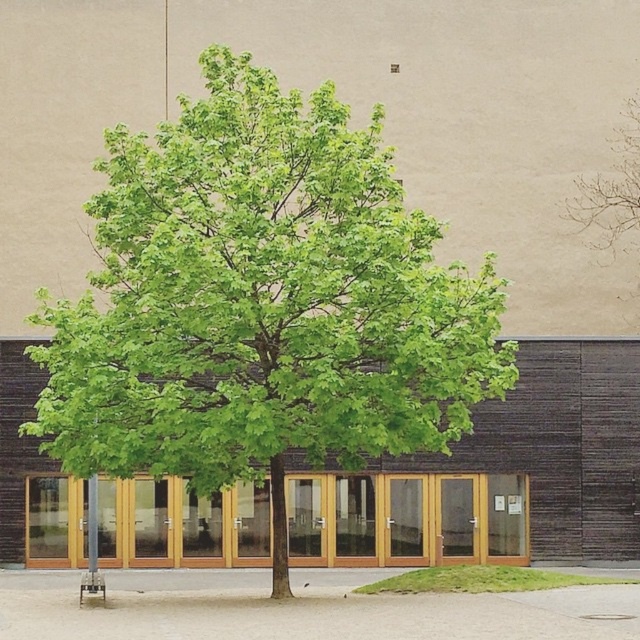
Question: Where is green leafy tree at center located in relation to green leafy tree at upper center in the image?

Choices:
 (A) left
 (B) right

Answer: (A)

Question: Among these objects, which one is nearest to the camera?

Choices:
 (A) green leafy tree at center
 (B) green leafy tree at upper center

Answer: (A)

Question: Which point is closer to the camera?

Choices:
 (A) green leafy tree at upper center
 (B) green leafy tree at center

Answer: (B)

Question: Does green leafy tree at center appear under green leafy tree at upper center?

Choices:
 (A) no
 (B) yes

Answer: (B)

Question: Can you confirm if green leafy tree at center is positioned below green leafy tree at upper center?

Choices:
 (A) yes
 (B) no

Answer: (A)